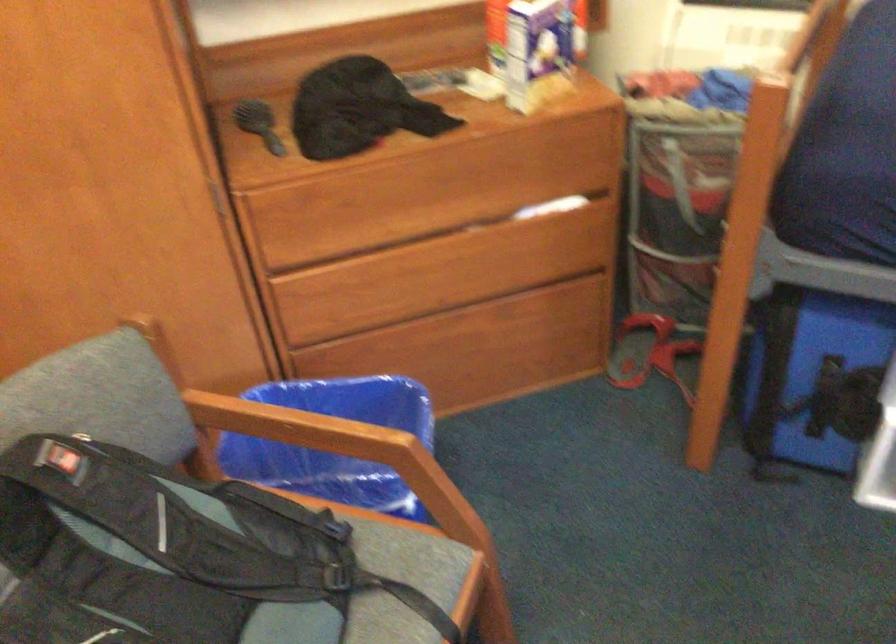
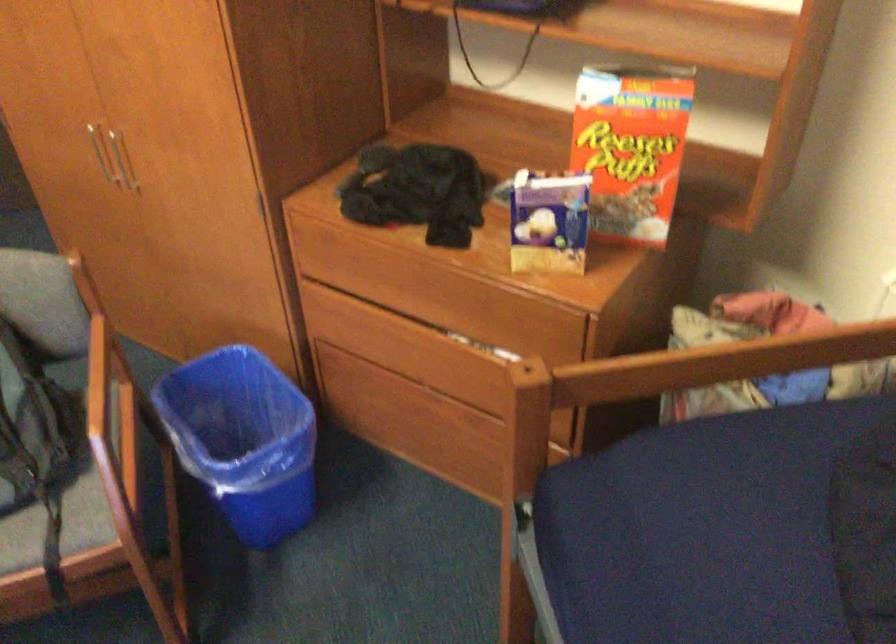
Question: I am providing you with two images of the same scene from different viewpoints. After the viewpoint changes to image2, which objects are now occluded?

Choices:
 (A) backpack strap
 (B) clear pump bottle
 (C) red flip-flop
 (D) blue trash can

Answer: (C)